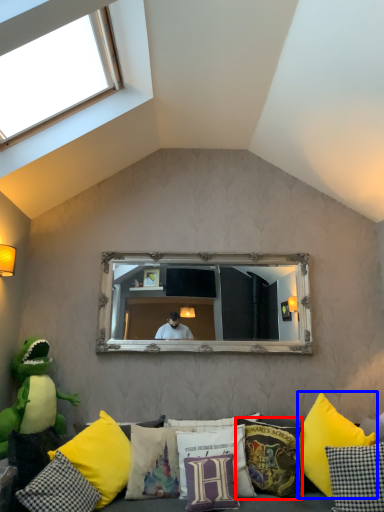
Question: Which object is further to the camera taking this photo, pillow (highlighted by a red box) or pillow (highlighted by a blue box)?

Choices:
 (A) pillow
 (B) pillow

Answer: (A)